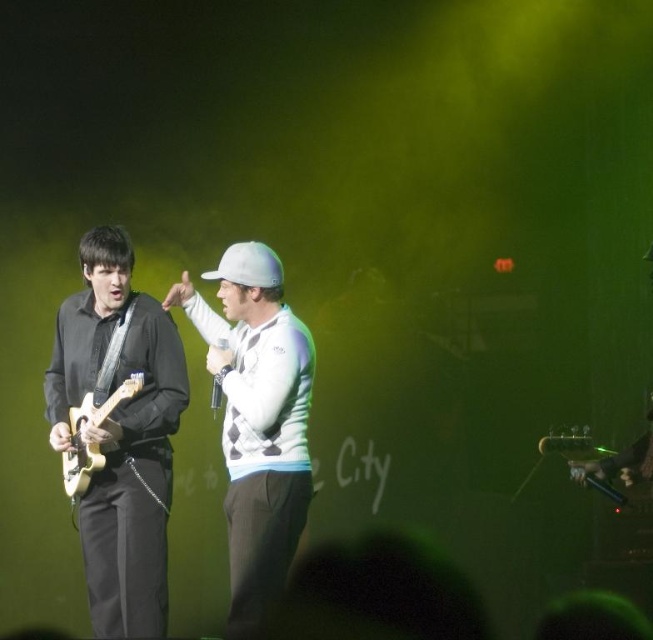
Question: Is matte black guitar at left bigger than white textured sweater at center?

Choices:
 (A) no
 (B) yes

Answer: (A)

Question: Considering the real-world distances, which object is closest to the matte black guitar at left?

Choices:
 (A) light wood electric guitar at left
 (B) white textured sweater at center

Answer: (A)

Question: Is matte black guitar at left below white textured sweater at center?

Choices:
 (A) no
 (B) yes

Answer: (B)

Question: Which object appears closest to the camera in this image?

Choices:
 (A) white textured sweater at center
 (B) matte black guitar at left
 (C) light wood electric guitar at left

Answer: (A)

Question: Is matte black guitar at left below white textured sweater at center?

Choices:
 (A) no
 (B) yes

Answer: (B)

Question: Which object is the farthest from the matte black guitar at left?

Choices:
 (A) light wood electric guitar at left
 (B) white textured sweater at center

Answer: (B)